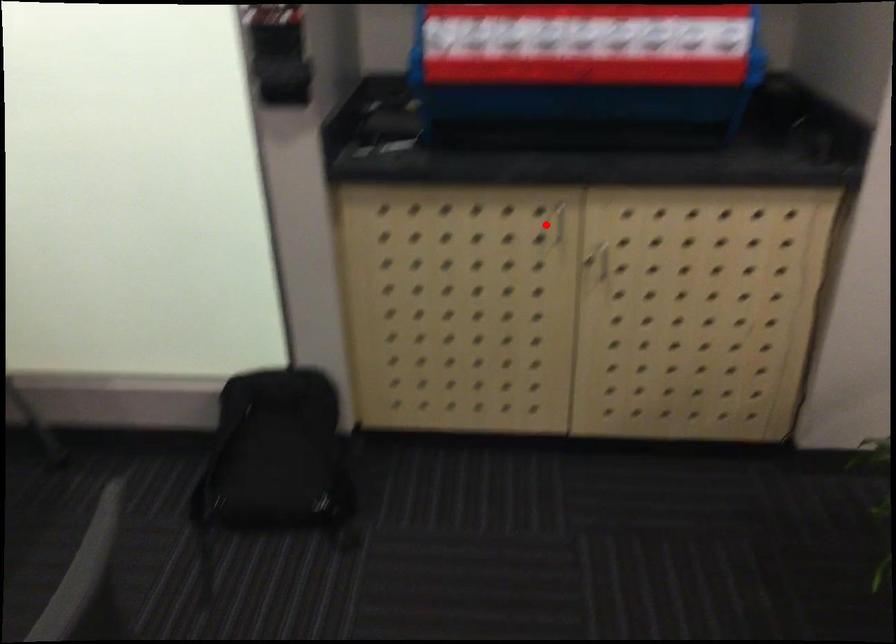
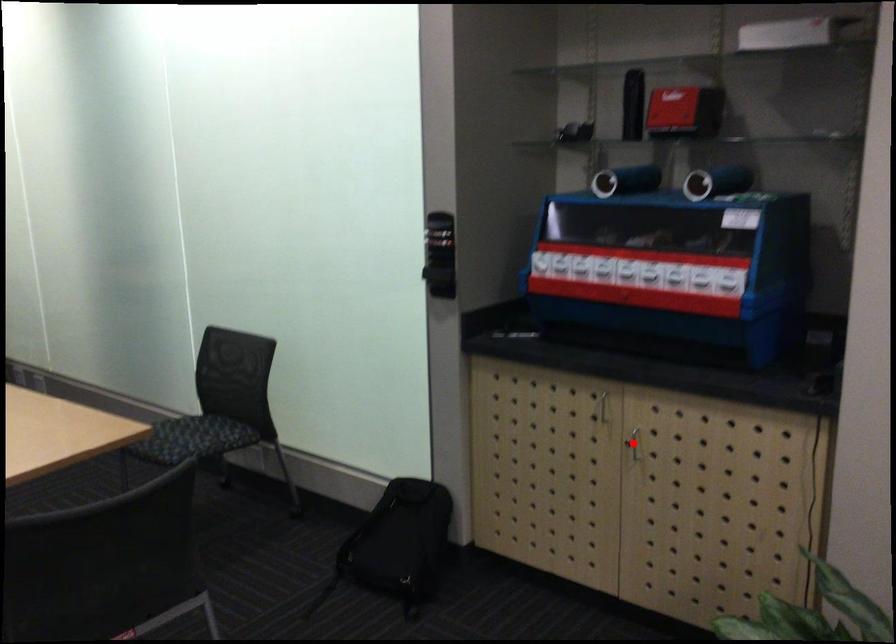
I am providing you with two images of the same scene from different viewpoints. A red point is marked on the first image and another point is marked on the second image. Does the point marked in image1 correspond to the same location as the one in image2?

No